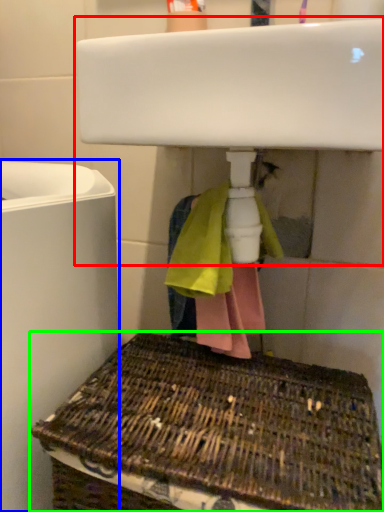
Question: Based on their relative distances, which object is nearer to sink (highlighted by a red box)? Choose from appliance (highlighted by a blue box) and basket (highlighted by a green box).

Choices:
 (A) appliance
 (B) basket

Answer: (A)